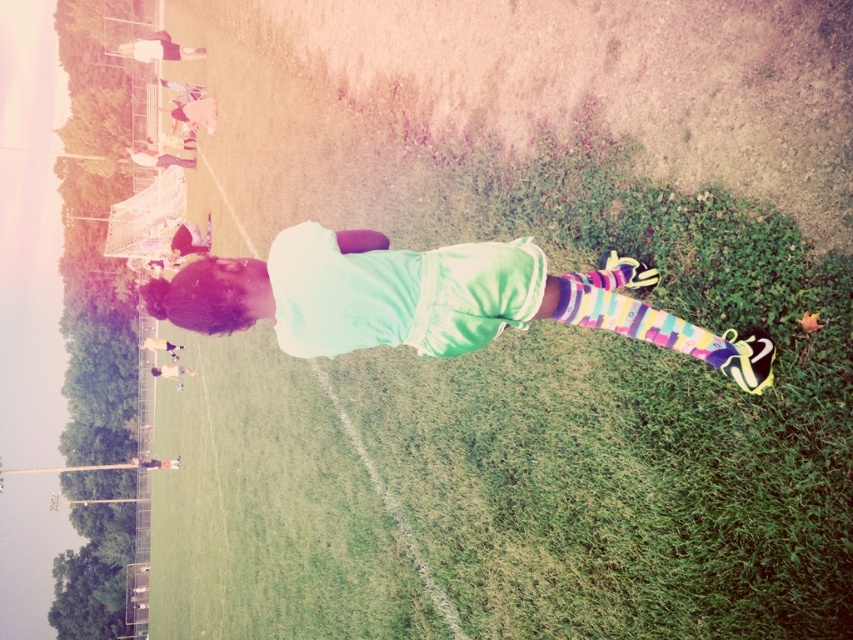
Which is more to the right, white matte shirt at center or multicolored knitted sock at lower right?

From the viewer's perspective, multicolored knitted sock at lower right appears more on the right side.

Who is higher up, white matte shirt at center or multicolored knitted sock at lower right?

white matte shirt at center

Who is more distant from viewer, [531,282] or [704,342]?

The point [531,282] is behind.

I want to click on white matte shirt at center, so click(x=422, y=298).